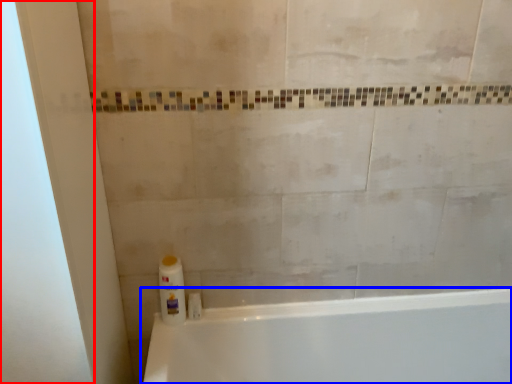
Question: Among these objects, which one is nearest to the camera, screen door (highlighted by a red box) or bathtub (highlighted by a blue box)?

Choices:
 (A) screen door
 (B) bathtub

Answer: (A)